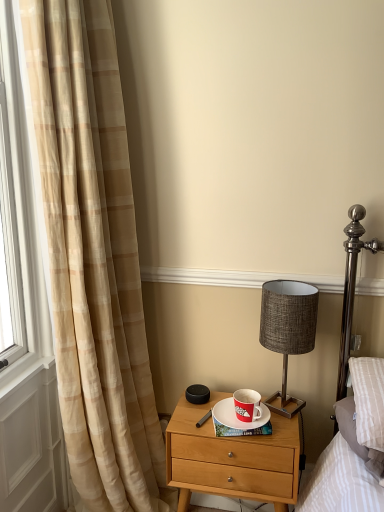
Question: Is white ceramic saucer at center shorter than red matte coffee cup at center?

Choices:
 (A) yes
 (B) no

Answer: (A)

Question: Considering the relative sizes of white ceramic saucer at center and red matte coffee cup at center in the image provided, is white ceramic saucer at center smaller than red matte coffee cup at center?

Choices:
 (A) yes
 (B) no

Answer: (A)

Question: Is white ceramic saucer at center aimed at red matte coffee cup at center?

Choices:
 (A) yes
 (B) no

Answer: (A)

Question: Is white ceramic saucer at center beside red matte coffee cup at center?

Choices:
 (A) no
 (B) yes

Answer: (B)

Question: Can you confirm if white ceramic saucer at center is positioned to the right of red matte coffee cup at center?

Choices:
 (A) no
 (B) yes

Answer: (A)

Question: Are white ceramic saucer at center and red matte coffee cup at center far apart?

Choices:
 (A) yes
 (B) no

Answer: (B)

Question: Is metallic gray lampshade at center-right looking in the opposite direction of white ceramic saucer at center?

Choices:
 (A) yes
 (B) no

Answer: (B)

Question: Is metallic gray lampshade at center-right closer to camera compared to white ceramic saucer at center?

Choices:
 (A) no
 (B) yes

Answer: (B)

Question: From the image's perspective, is metallic gray lampshade at center-right under white ceramic saucer at center?

Choices:
 (A) no
 (B) yes

Answer: (A)

Question: Is metallic gray lampshade at center-right aimed at white ceramic saucer at center?

Choices:
 (A) no
 (B) yes

Answer: (A)

Question: Is metallic gray lampshade at center-right shorter than white ceramic saucer at center?

Choices:
 (A) yes
 (B) no

Answer: (B)

Question: From the image's perspective, is metallic gray lampshade at center-right over white ceramic saucer at center?

Choices:
 (A) yes
 (B) no

Answer: (A)

Question: From a real-world perspective, does beige plaid curtain at left sit lower than metallic gray lampshade at center-right?

Choices:
 (A) yes
 (B) no

Answer: (B)